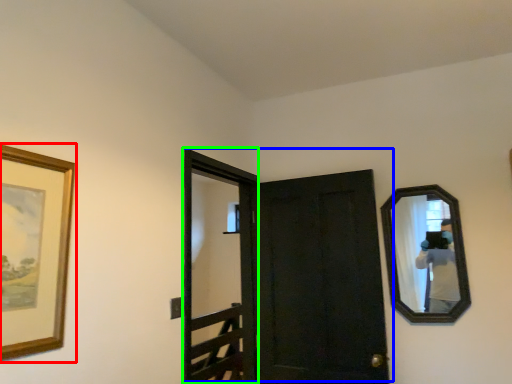
Question: Which is farther away from picture frame (highlighted by a red box)? door (highlighted by a blue box) or screen door (highlighted by a green box)?

Choices:
 (A) door
 (B) screen door

Answer: (B)